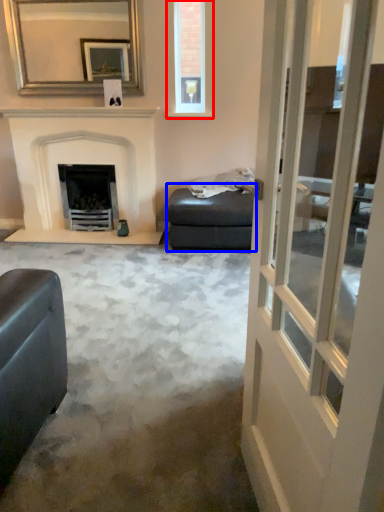
Question: Which of the following is the closest to the observer, window (highlighted by a red box) or footrest (highlighted by a blue box)?

Choices:
 (A) window
 (B) footrest

Answer: (B)